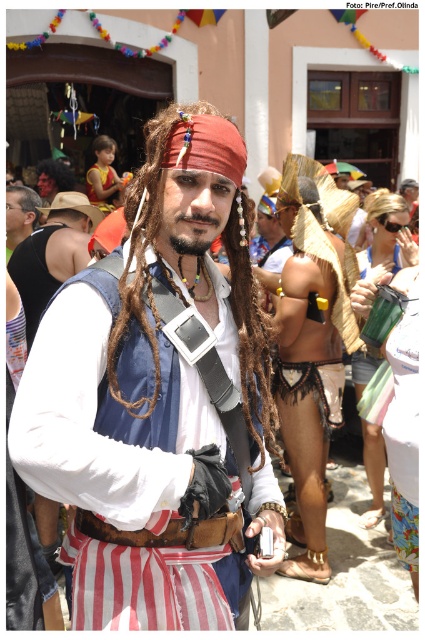
You are at a costume party and see two vests on the central figure. The first is a matte blue vest at center, and the second is a white matte vest at center. Which vest is positioned higher on the person?

The matte blue vest at center is taller than the white matte vest at center, so the blue one is higher.

You are at a festival and see two items in the scene. One is the brown woven fabric at center and the other is the matte black vest at left. Which one is located more to the right?

The brown woven fabric at center is more to the right because it is positioned on the right side of the matte black vest at left.

Based on the scene description, where is the brown woven fabric at center located in terms of coordinates?

The brown woven fabric at center is located at coordinates point (311, 360).